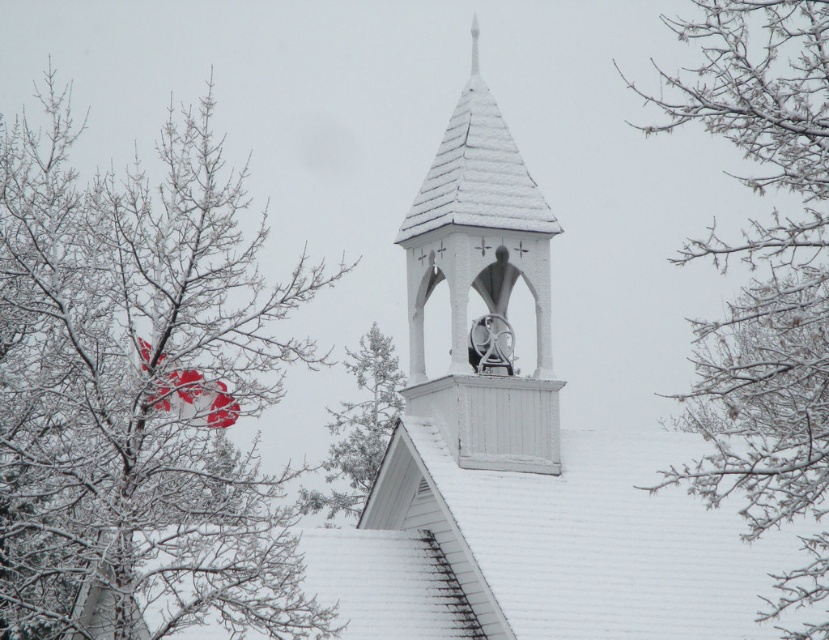
Who is higher up, snow-covered branches at upper center or white wooden bell tower at upper center?

snow-covered branches at upper center is higher up.

Locate an element on the screen. The height and width of the screenshot is (640, 829). snow-covered branches at upper center is located at coordinates (762, 259).

The image size is (829, 640). What are the coordinates of `snow-covered branches at upper center` in the screenshot? It's located at (762, 259).

Can you confirm if white wooden bell tower at upper center is wider than green textured pine tree at upper center?

Yes.

Measure the distance between white wooden bell tower at upper center and camera.

white wooden bell tower at upper center and camera are 296.10 feet apart.

Locate an element on the screen. white wooden bell tower at upper center is located at coordinates (481, 288).

Between snow-covered branches at left and green textured pine tree at upper center, which one appears on the right side from the viewer's perspective?

Positioned to the right is green textured pine tree at upper center.

Who is shorter, snow-covered branches at left or green textured pine tree at upper center?

Standing shorter between the two is green textured pine tree at upper center.

Does point (110, 429) lie behind point (355, 436)?

No.

This screenshot has width=829, height=640. Identify the location of snow-covered branches at left. (x=139, y=392).